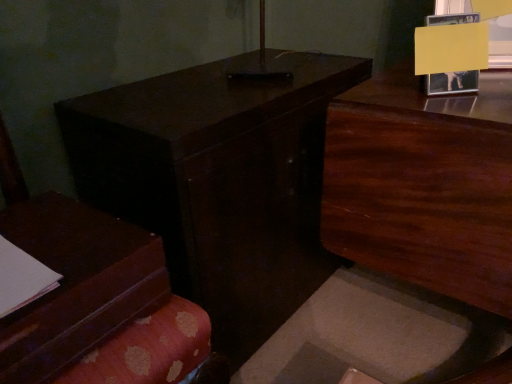
Question: Looking at the image, does dark wood table at center seem bigger or smaller compared to dark wood dresser at upper right?

Choices:
 (A) small
 (B) big

Answer: (B)

Question: Is dark wood table at center to the left or to the right of dark wood dresser at upper right in the image?

Choices:
 (A) right
 (B) left

Answer: (B)

Question: Estimate the real-world distances between objects in this image. Which object is closer to the dark wood dresser at upper right?

Choices:
 (A) dark wood table at center
 (B) matte brown book at left

Answer: (A)

Question: Considering the real-world distances, which object is farthest from the dark wood dresser at upper right?

Choices:
 (A) matte brown book at left
 (B) dark wood table at center

Answer: (A)